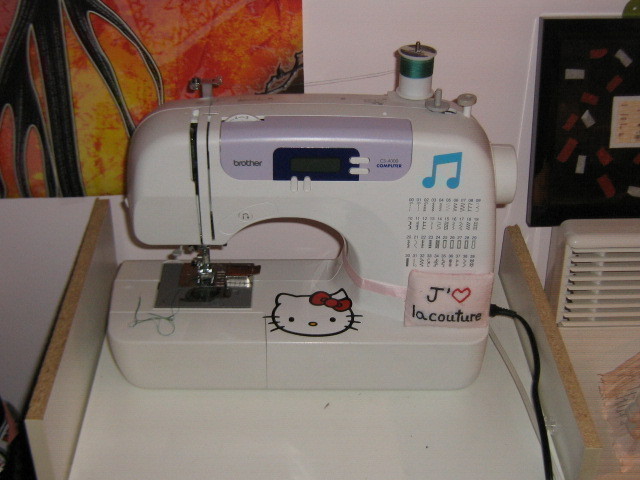
This screenshot has width=640, height=480. What are the coordinates of `power cord` in the screenshot? It's located at (532, 381).